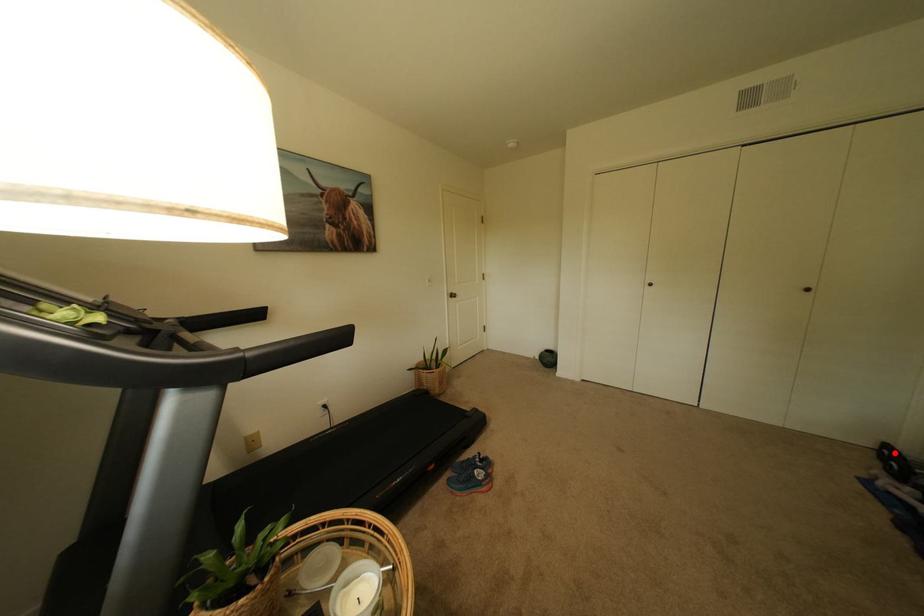
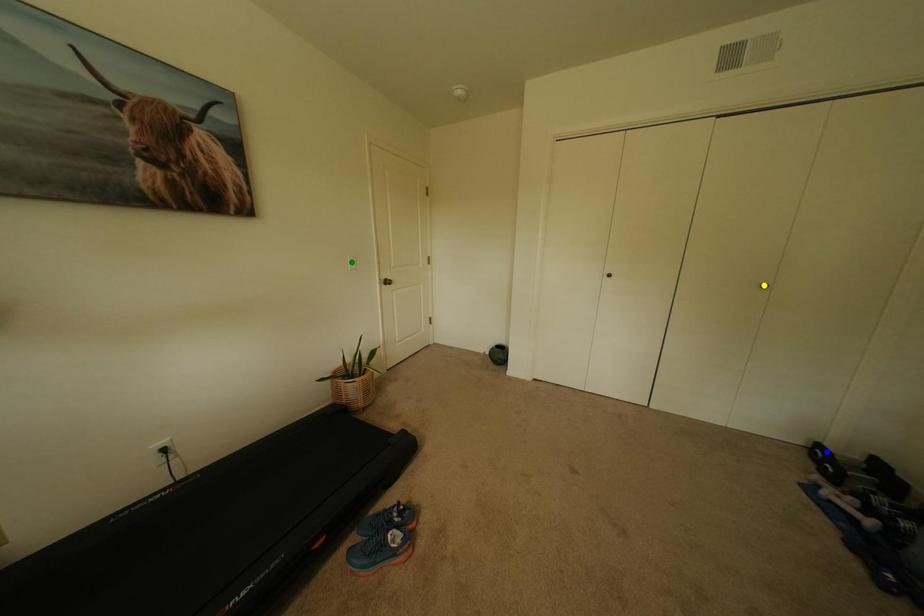
Question: I am providing you with two images of the same scene from different viewpoints. A red point is marked on the first image. You are given multiple points on the second image. Which point in image 2 is actually the same real-world point as the red point in image 1?

Choices:
 (A) yellow point
 (B) blue point
 (C) green point

Answer: (B)